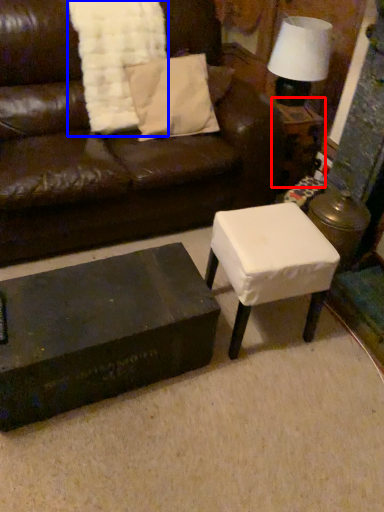
Question: Which object appears closest to the camera in this image, side table (highlighted by a red box) or blanket (highlighted by a blue box)?

Choices:
 (A) side table
 (B) blanket

Answer: (B)